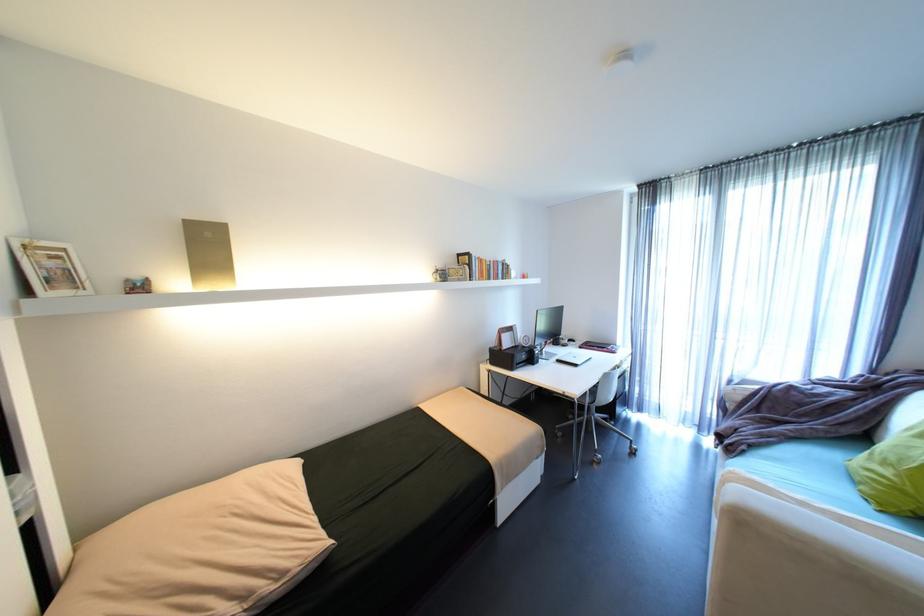
The image size is (924, 616). What are the coordinates of `sofa sitting surface` in the screenshot? It's located at (807, 468).